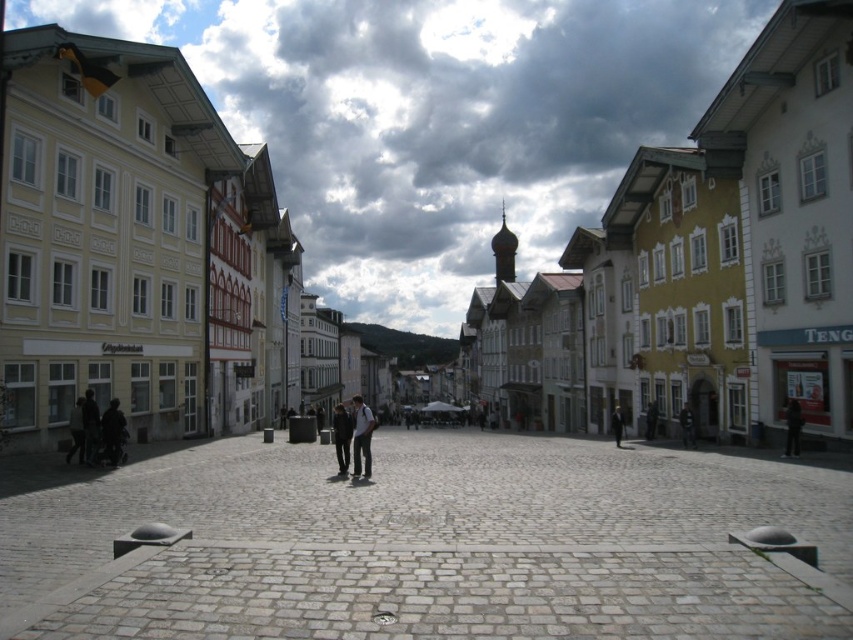
Question: Does black leather jacket at center appear on the left side of dark gray fabric jacket at lower left?

Choices:
 (A) no
 (B) yes

Answer: (A)

Question: Can you confirm if dark brown leather jacket at center is positioned to the left of dark blue suit at center?

Choices:
 (A) yes
 (B) no

Answer: (B)

Question: Which of the following is the farthest from the observer?

Choices:
 (A) white stone pavement at center
 (B) black leather jacket at center
 (C) dark gray fabric jacket at lower left

Answer: (B)

Question: Which point is closer to the camera taking this photo?

Choices:
 (A) (364, 445)
 (B) (83, 401)
 (C) (119, 452)

Answer: (C)

Question: Which of these objects is positioned closest to the dark gray fabric coat at center?

Choices:
 (A) dark gray suit at center
 (B) white stone pavement at center
 (C) dark gray pants at center

Answer: (B)

Question: Is white stone pavement at center smaller than black leather jacket at center?

Choices:
 (A) no
 (B) yes

Answer: (A)